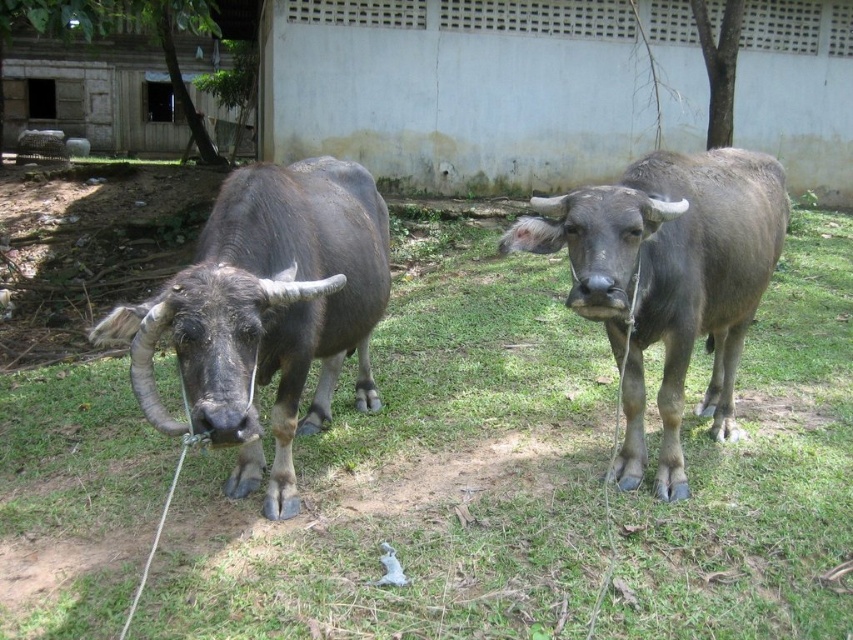
Who is taller, green grass at center or gray matte bull at center?

gray matte bull at center

Is green grass at center wider than gray matte bull at center?

Indeed, green grass at center has a greater width compared to gray matte bull at center.

Find the location of `green grass at center`. green grass at center is located at coordinates (419, 483).

The height and width of the screenshot is (640, 853). What are the coordinates of `green grass at center` in the screenshot? It's located at (419, 483).

Does dark brown glossy bull at center have a greater width compared to gray matte bull at center?

No.

Does dark brown glossy bull at center appear on the left side of gray matte bull at center?

Indeed, dark brown glossy bull at center is positioned on the left side of gray matte bull at center.

Is point (198, 240) positioned after point (682, 278)?

Yes, it is behind point (682, 278).

At what (x,y) coordinates should I click in order to perform the action: click on dark brown glossy bull at center. Please return your answer as a coordinate pair (x, y). The width and height of the screenshot is (853, 640). Looking at the image, I should click on (267, 310).

How distant is green grass at center from dark brown glossy bull at center?

green grass at center and dark brown glossy bull at center are 3.45 feet apart from each other.

Does point (689, 632) lie behind point (287, 257)?

No, (689, 632) is in front of (287, 257).

Image resolution: width=853 pixels, height=640 pixels. Find the location of `green grass at center`. green grass at center is located at coordinates (419, 483).